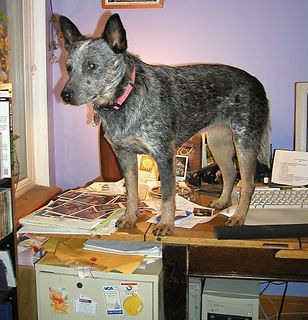
Locate an element on the screen. Image resolution: width=308 pixels, height=320 pixels. pictures is located at coordinates (79, 212).